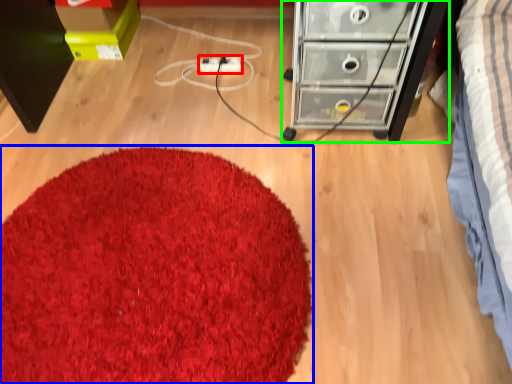
Question: Considering the real-world distances, which object is farthest from extension cord (highlighted by a red box)? mat (highlighted by a blue box) or chest of drawers (highlighted by a green box)?

Choices:
 (A) mat
 (B) chest of drawers

Answer: (A)